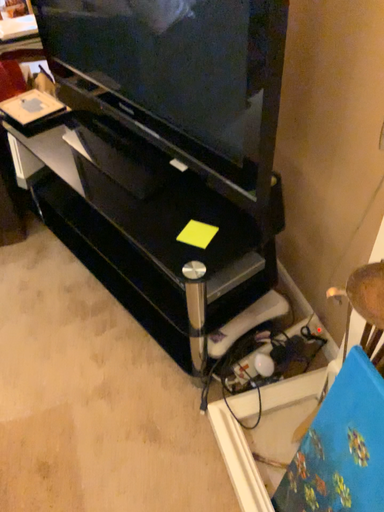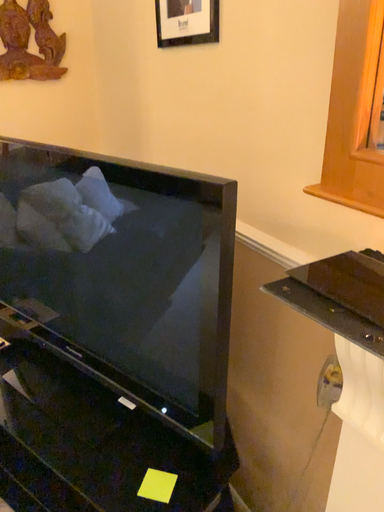
Question: Which way did the camera rotate in the video?

Choices:
 (A) rotated left
 (B) rotated right

Answer: (B)